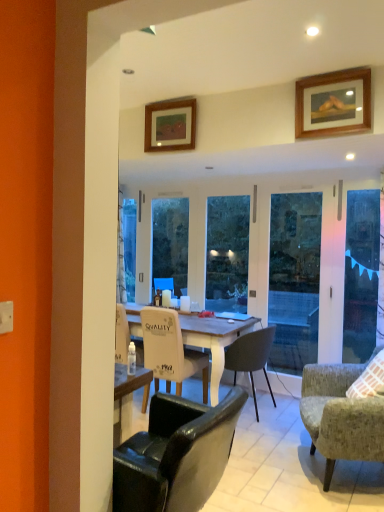
Locate an element on the screen. free point above wooden picture frame at upper center, marked as the 2th picture frame in a right-to-left arrangement (from a real-world perspective) is located at coordinates (165, 102).